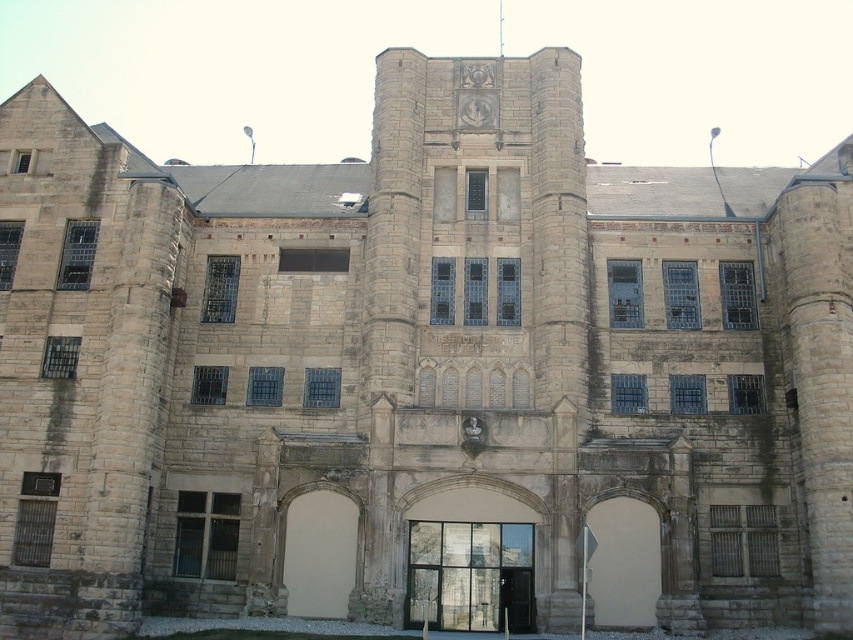
Question: Which object is positioned farthest from the clear glass door at center?

Choices:
 (A) white stone archway at center
 (B) smooth beige door at center

Answer: (A)

Question: Which of the following is the closest to the observer?

Choices:
 (A) (602, 605)
 (B) (343, 538)

Answer: (A)

Question: Is clear glass door at center above white stone archway at center?

Choices:
 (A) no
 (B) yes

Answer: (A)

Question: Does clear glass door at center lie behind white stone archway at center?

Choices:
 (A) no
 (B) yes

Answer: (A)

Question: Among these points, which one is nearest to the camera?

Choices:
 (A) (418, 582)
 (B) (328, 536)
 (C) (608, 596)

Answer: (C)

Question: Is smooth beige door at center below white stone archway at center?

Choices:
 (A) yes
 (B) no

Answer: (A)